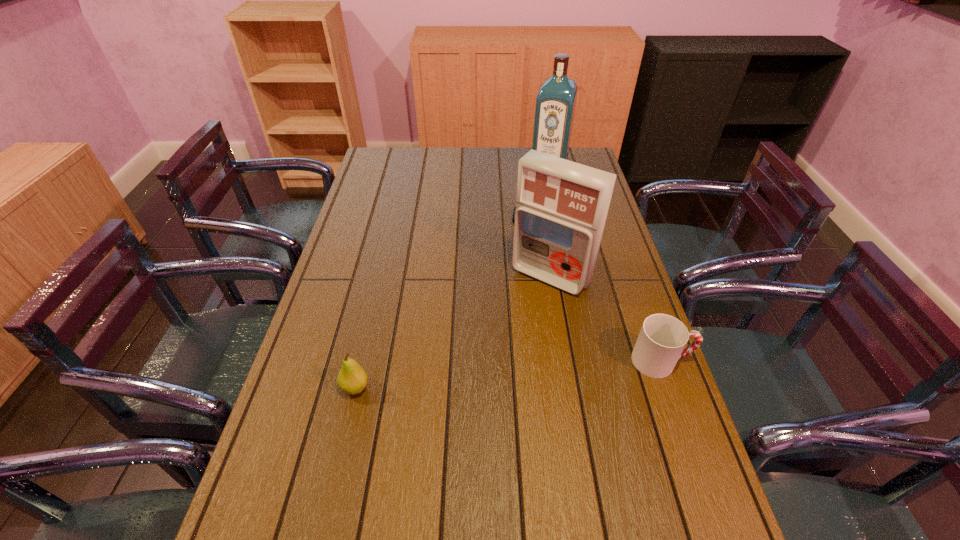
I want to click on vacant area in the image that satisfies the following two spatial constraints: 1. on the front side of the farthest object; 2. on the side of the cup where the handle is located, so click(x=590, y=361).